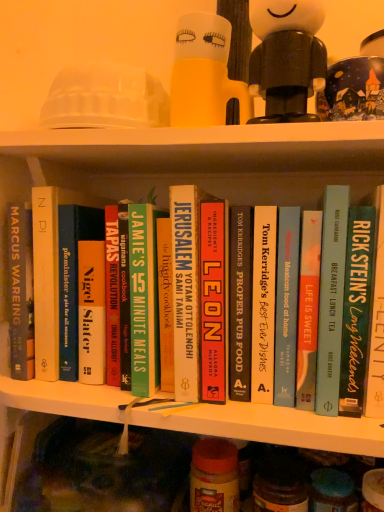
Question: From the image's perspective, is green matte book at center, which appears as the 7th book when viewed from the right, positioned above or below hardcover book at center, the sixth book from the left?

Choices:
 (A) above
 (B) below

Answer: (B)

Question: Is point (155, 358) positioned closer to the camera than point (329, 394)?

Choices:
 (A) farther
 (B) closer

Answer: (A)

Question: Estimate the real-world distances between objects in this image. Which object is closer to the translucent yellow cup at upper center?

Choices:
 (A) translucent plastic jar at center, arranged as the second glass jar when viewed from the right
 (B) hardcover cookbook at center, acting as the sixth book starting from the right
 (C) hardcover book at center, placed as the 3th book when sorted from right to left
 (D) white matte figurine at upper center
 (E) hardcover book at center, acting as the 2th book starting from the right

Answer: (D)

Question: Which of these objects is positioned closest to the blue glass jar at lower right, the second glass jar when ordered from left to right?

Choices:
 (A) translucent plastic jar at center, arranged as the second glass jar when viewed from the right
 (B) black hardcover book at center, which is counted as the 5th book, starting from the left
 (C) white hardcover book at center, the 1th book when ordered from left to right
 (D) translucent yellow cup at upper center
 (E) hardcover book at center, acting as the 2th book starting from the right

Answer: (A)